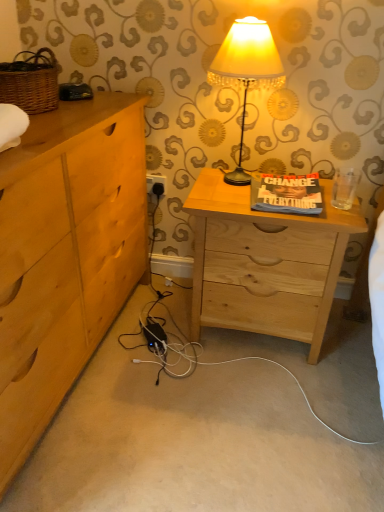
Question: Does white plastic electric outlet at lower center touch matte cream lampshade at center?

Choices:
 (A) yes
 (B) no

Answer: (B)

Question: Is white plastic electric outlet at lower center facing away from matte cream lampshade at center?

Choices:
 (A) yes
 (B) no

Answer: (B)

Question: Could you tell me if white plastic electric outlet at lower center is turned towards matte cream lampshade at center?

Choices:
 (A) no
 (B) yes

Answer: (A)

Question: From a real-world perspective, is white plastic electric outlet at lower center below matte cream lampshade at center?

Choices:
 (A) no
 (B) yes

Answer: (B)

Question: Is white plastic electric outlet at lower center at the left side of matte cream lampshade at center?

Choices:
 (A) no
 (B) yes

Answer: (B)

Question: Does white plastic electric outlet at lower center have a greater width compared to matte cream lampshade at center?

Choices:
 (A) no
 (B) yes

Answer: (A)

Question: Is the position of matte cream lampshade at center less distant than that of natural wood nightstand at center?

Choices:
 (A) yes
 (B) no

Answer: (A)

Question: Is matte cream lampshade at center far from natural wood nightstand at center?

Choices:
 (A) yes
 (B) no

Answer: (B)

Question: Is natural wood nightstand at center at the back of matte cream lampshade at center?

Choices:
 (A) yes
 (B) no

Answer: (B)

Question: Is matte cream lampshade at center next to natural wood nightstand at center and touching it?

Choices:
 (A) yes
 (B) no

Answer: (B)

Question: Is matte cream lampshade at center shorter than natural wood nightstand at center?

Choices:
 (A) no
 (B) yes

Answer: (B)

Question: Is matte cream lampshade at center outside natural wood nightstand at center?

Choices:
 (A) yes
 (B) no

Answer: (A)

Question: Can you confirm if light wood chest of drawers at left is bigger than white plastic electric outlet at lower center?

Choices:
 (A) yes
 (B) no

Answer: (A)